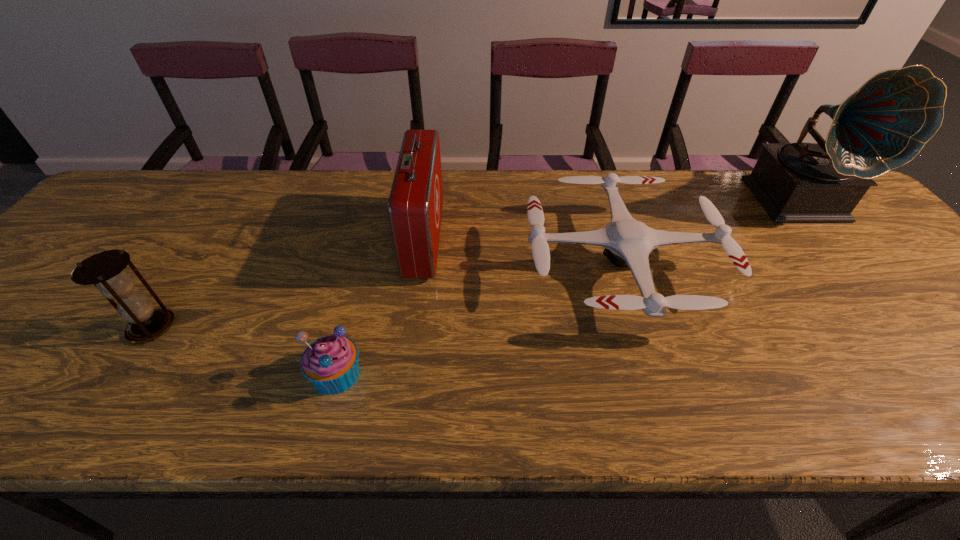
You are a GUI agent. You are given a task and a screenshot of the screen. Output one action in this format:
    pyautogui.click(x=<x>, y=<y>)
    Task: Click on the free area in between the drone and the third object from left to right
    
    Given the screenshot: What is the action you would take?
    pyautogui.click(x=522, y=252)

What are the coordinates of `free area in between the drone and the first-aid kit` in the screenshot? It's located at (522, 252).

This screenshot has width=960, height=540. Identify the location of empty space that is in between the third object from left to right and the fourth object from right to left. (380, 306).

You are a GUI agent. You are given a task and a screenshot of the screen. Output one action in this format:
    pyautogui.click(x=<x>, y=<y>)
    Task: Click on the unoccupied position between the record player and the nearest object
    The image size is (960, 540).
    Given the screenshot: What is the action you would take?
    pyautogui.click(x=568, y=287)

Identify which object is the closest to the nearest object. Please provide its 2D coordinates. Your answer should be formatted as a tuple, i.e. [(x, y)], where the tuple contains the x and y coordinates of a point satisfying the conditions above.

[(415, 204)]

Locate which object ranks second in proximity to the leftmost object. Please provide its 2D coordinates. Your answer should be formatted as a tuple, i.e. [(x, y)], where the tuple contains the x and y coordinates of a point satisfying the conditions above.

[(415, 204)]

Find the location of `vacant space that satisfies the following two spatial constraints: 1. on the horn of the rightmost object; 2. on the side of the first-aid kit with the first aid cross symbol`. vacant space that satisfies the following two spatial constraints: 1. on the horn of the rightmost object; 2. on the side of the first-aid kit with the first aid cross symbol is located at coordinates (833, 239).

Image resolution: width=960 pixels, height=540 pixels. In order to click on vacant area that satisfies the following two spatial constraints: 1. on the front side of the third tallest object; 2. on the left side of the second object from left to right in this screenshot , I will do `click(122, 373)`.

What are the coordinates of `free spot that satisfies the following two spatial constraints: 1. on the horn of the rightmost object; 2. on the side of the second tallest object with the first aid cross symbol` in the screenshot? It's located at (833, 239).

At what (x,y) coordinates should I click in order to perform the action: click on vacant space that satisfies the following two spatial constraints: 1. on the horn of the rightmost object; 2. with the camera attached at the bottom of the fourth object from left to right. Please return your answer as a coordinate pair (x, y). This screenshot has height=540, width=960. Looking at the image, I should click on (855, 265).